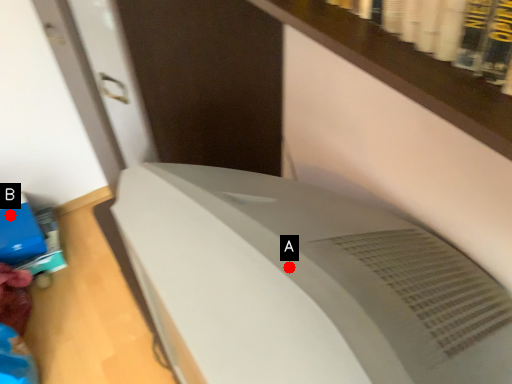
Question: Two points are circled on the image, labeled by A and B beside each circle. Which point is closer to the camera?

Choices:
 (A) A is closer
 (B) B is closer

Answer: (A)